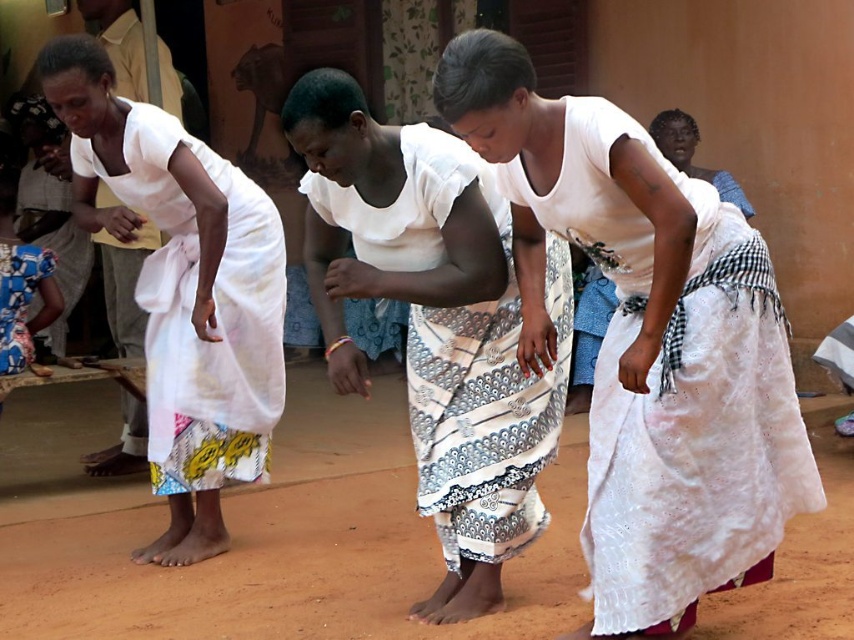
Can you confirm if white woven cloth at left is positioned to the right of white lace cloth at upper right?

Incorrect, white woven cloth at left is not on the right side of white lace cloth at upper right.

Locate an element on the screen. The width and height of the screenshot is (854, 640). white woven cloth at left is located at coordinates (183, 291).

I want to click on white woven cloth at left, so click(x=183, y=291).

Between white textured cloth at center and blue and white printed fabric dress at lower left, which one is positioned higher?

blue and white printed fabric dress at lower left

Identify the location of white textured cloth at center. (646, 342).

Which of these two, blue and white printed fabric dress at lower left or white lace cloth at upper right, stands shorter?

blue and white printed fabric dress at lower left

Is blue and white printed fabric dress at lower left to the left of white lace cloth at upper right from the viewer's perspective?

Indeed, blue and white printed fabric dress at lower left is positioned on the left side of white lace cloth at upper right.

Between point (22, 289) and point (686, 163), which one is positioned behind?

The point (686, 163) is more distant.

This screenshot has height=640, width=854. What are the coordinates of `blue and white printed fabric dress at lower left` in the screenshot? It's located at (19, 300).